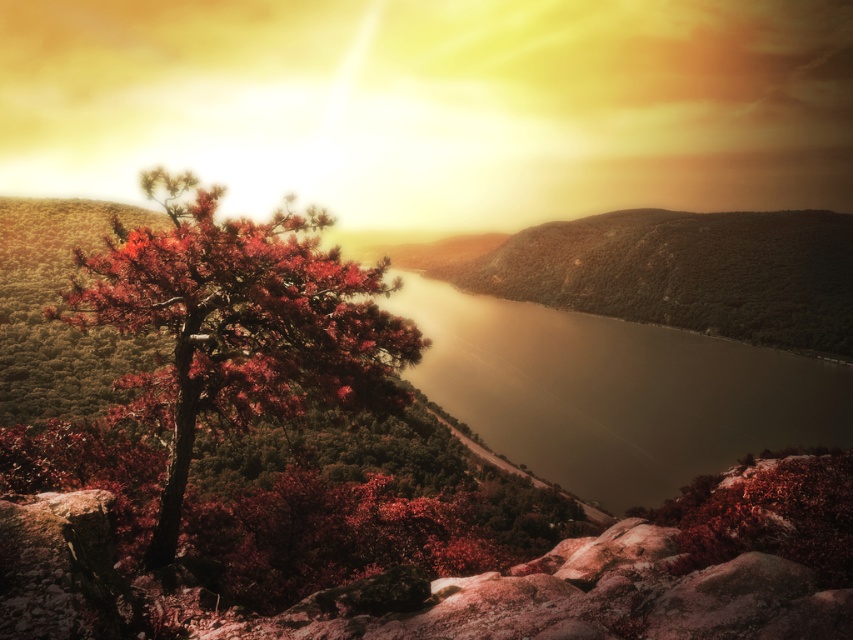
Question: Can you confirm if smooth dark water at center is wider than reddish-brown bark tree at left?

Choices:
 (A) no
 (B) yes

Answer: (B)

Question: Which object appears farthest from the camera in this image?

Choices:
 (A) reddish-brown bark tree at left
 (B) smooth dark water at center

Answer: (B)

Question: Can you confirm if smooth dark water at center is positioned below reddish-brown bark tree at left?

Choices:
 (A) no
 (B) yes

Answer: (B)

Question: Is smooth dark water at center above reddish-brown bark tree at left?

Choices:
 (A) no
 (B) yes

Answer: (A)

Question: Which point is farther to the camera?

Choices:
 (A) reddish-brown bark tree at left
 (B) smooth dark water at center

Answer: (B)